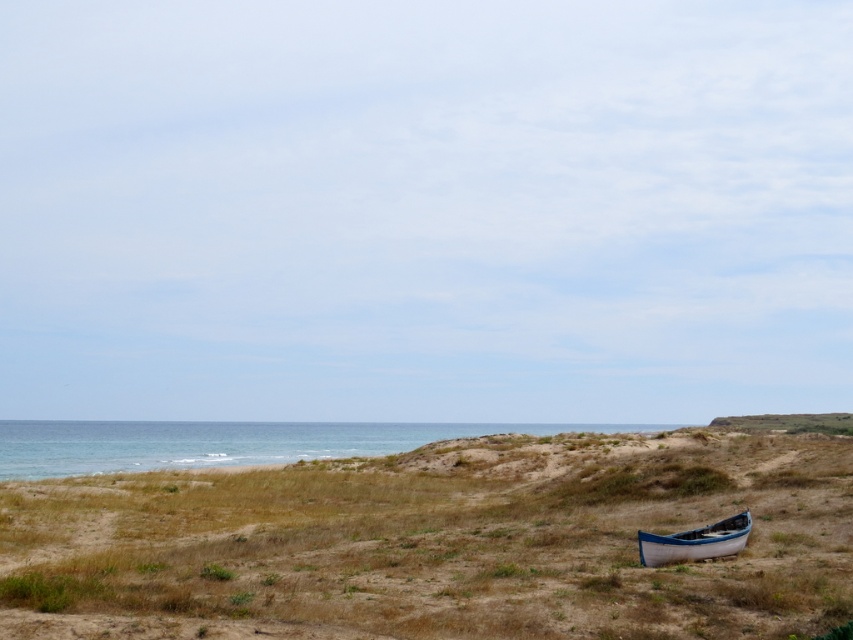
Question: Is blue water at lower left bigger than white canvas canoe at lower right?

Choices:
 (A) no
 (B) yes

Answer: (B)

Question: Which of the following is the closest to the observer?

Choices:
 (A) (134, 435)
 (B) (648, 552)
 (C) (90, 618)

Answer: (C)

Question: Is brown grassy hillside at lower right above blue water at lower left?

Choices:
 (A) yes
 (B) no

Answer: (A)

Question: Which object is farther from the camera taking this photo?

Choices:
 (A) blue water at lower left
 (B) brown grassy hillside at lower right
 (C) white canvas canoe at lower right

Answer: (A)

Question: In this image, where is blue water at lower left located relative to white canvas canoe at lower right?

Choices:
 (A) right
 (B) left

Answer: (B)

Question: Based on their relative distances, which object is nearer to the white canvas canoe at lower right?

Choices:
 (A) blue water at lower left
 (B) brown grassy hillside at lower right

Answer: (B)